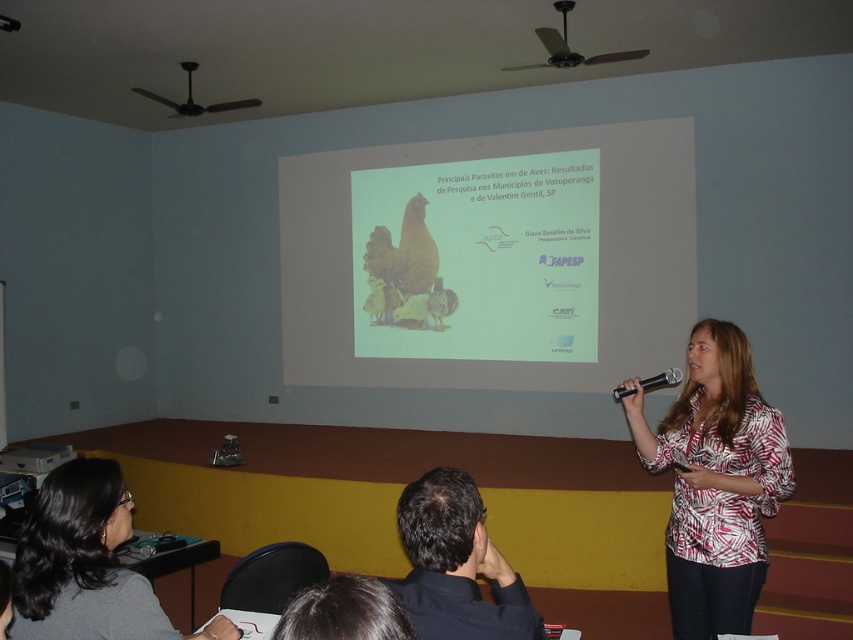
Question: Which object is closer to the camera taking this photo?

Choices:
 (A) dark brown hair at lower left
 (B) matte white screen at center
 (C) white printed shirt at center
 (D) dark hair at upper center

Answer: (D)

Question: Does matte white screen at center have a lesser width compared to dark brown hair at lower left?

Choices:
 (A) no
 (B) yes

Answer: (A)

Question: Which point appears closest to the camera in this image?

Choices:
 (A) (688, 362)
 (B) (642, 385)
 (C) (564, 58)
 (D) (616, 230)

Answer: (A)

Question: Is white printed shirt at center to the right of black plastic microphone at center from the viewer's perspective?

Choices:
 (A) yes
 (B) no

Answer: (A)

Question: Which object is positioned farthest from the dark brown hair at lower left?

Choices:
 (A) black plastic microphone at center
 (B) dark hair at upper center
 (C) black plastic projector at upper center
 (D) matte white screen at center

Answer: (D)

Question: From the image, what is the correct spatial relationship of white printed shirt at center in relation to black plastic projector at upper center?

Choices:
 (A) below
 (B) above

Answer: (A)